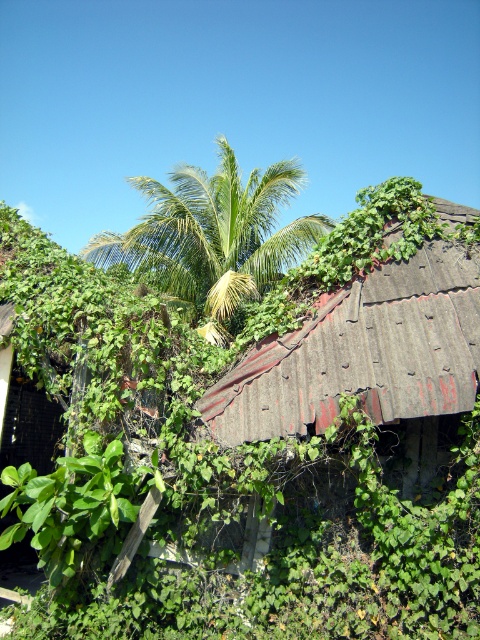
Is point (429, 372) more distant than point (210, 253)?

That is False.

Does rusty corrugated metal roof at center have a lesser height compared to green leafy palm tree at center?

Yes, rusty corrugated metal roof at center is shorter than green leafy palm tree at center.

I want to click on rusty corrugated metal roof at center, so click(x=362, y=353).